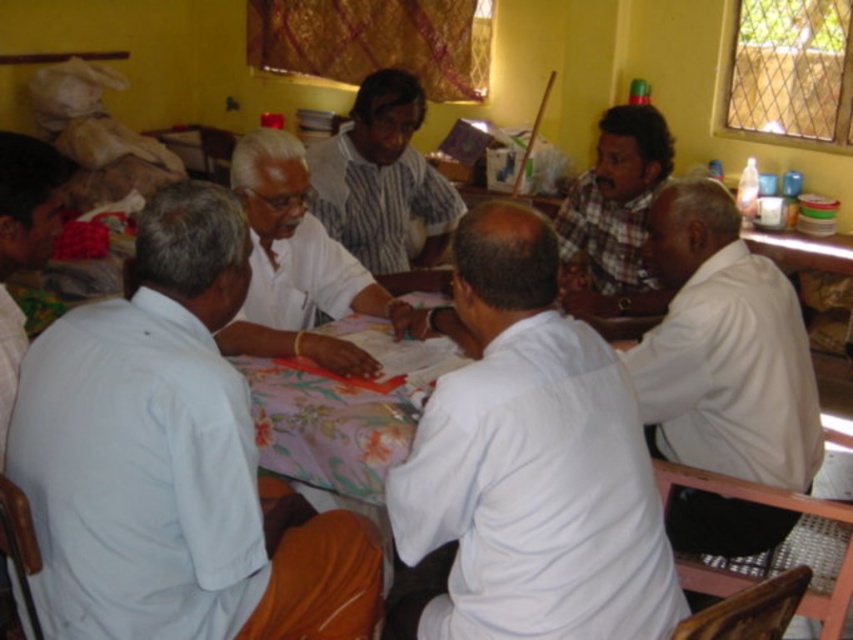
Is white cotton shirt at center bigger than light blue shirt at left?

Yes, white cotton shirt at center is bigger than light blue shirt at left.

Is white cotton shirt at center positioned in front of light blue shirt at left?

Yes, it is.

Is point (485, 304) behind point (15, 192)?

That is False.

Locate an element on the screen. white cotton shirt at center is located at coordinates (527, 465).

From the picture: Can you confirm if white cotton shirt at center is wider than striped cotton shirt at center?

Indeed, white cotton shirt at center has a greater width compared to striped cotton shirt at center.

Who is shorter, white cotton shirt at center or striped cotton shirt at center?

striped cotton shirt at center is shorter.

Locate an element on the screen. This screenshot has height=640, width=853. white cotton shirt at center is located at coordinates coord(527,465).

Can you confirm if white matte shirt at right is taller than striped cotton shirt at center?

Yes, white matte shirt at right is taller than striped cotton shirt at center.

Is white matte shirt at right positioned in front of striped cotton shirt at center?

Yes.

Measure the distance between white matte shirt at right and camera.

white matte shirt at right is 6.33 feet from camera.

Identify the location of white matte shirt at right. (724, 348).